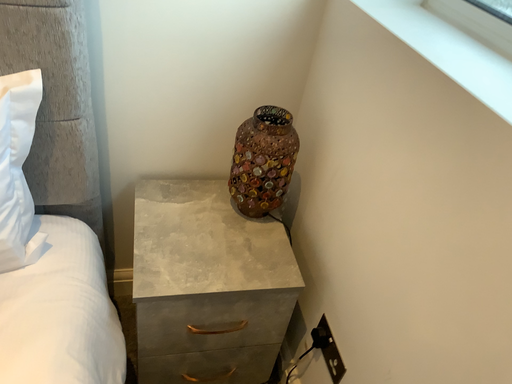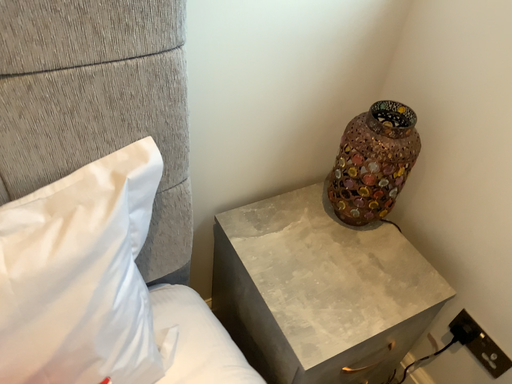
Question: Which way did the camera rotate in the video?

Choices:
 (A) rotated right
 (B) rotated left

Answer: (A)